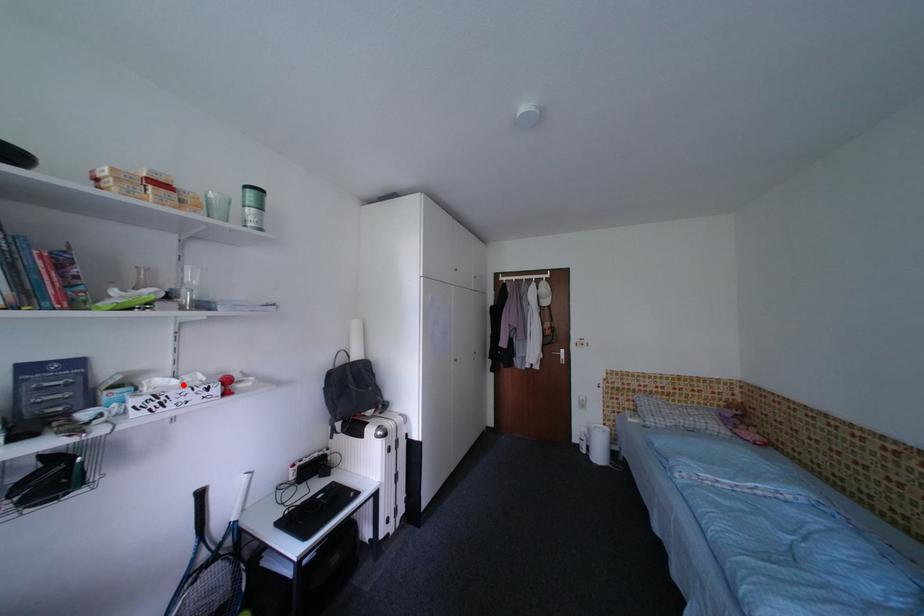
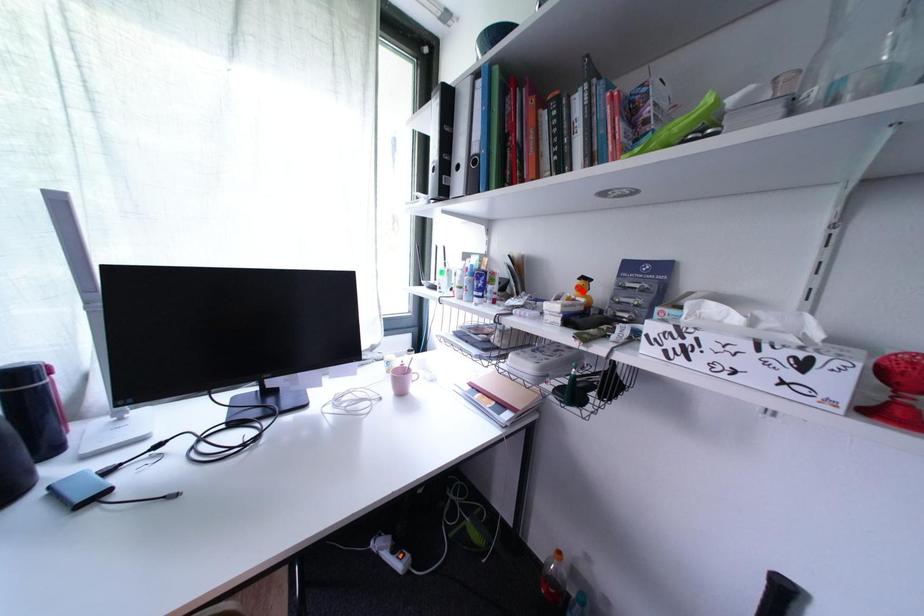
I am providing you with two images of the same scene from different viewpoints. A red point is marked on the first image and another point is marked on the second image. Are the points marked in image1 and image2 representing the same 3D position?

No